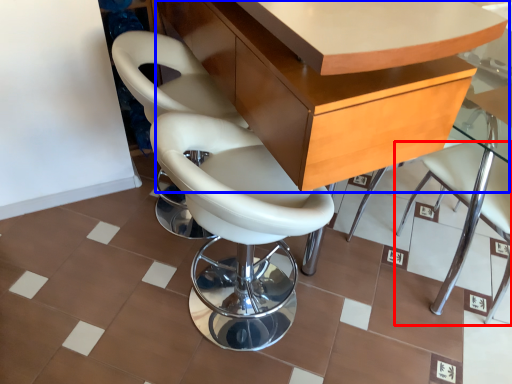
Question: Which of the following is the farthest to the observer, chair (highlighted by a red box) or table (highlighted by a blue box)?

Choices:
 (A) chair
 (B) table

Answer: (A)